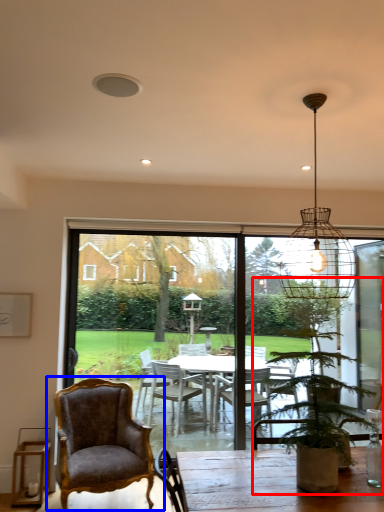
Question: Which point is closer to the camera, houseplant (highlighted by a red box) or chair (highlighted by a blue box)?

Choices:
 (A) houseplant
 (B) chair

Answer: (A)